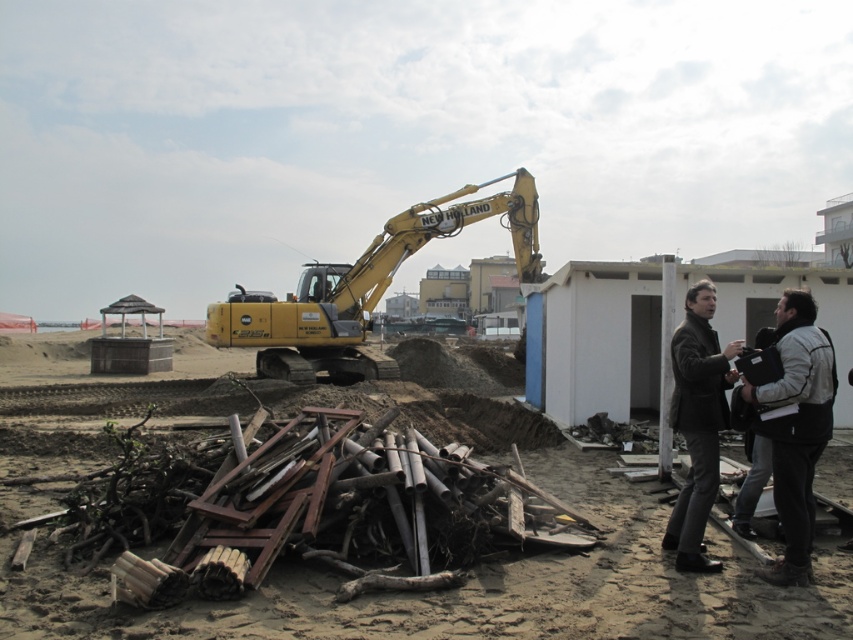
You are a construction worker who needs to move heavy equipment across the brown sandy dirt at center and the yellow metallic excavator at center. Which surface would provide a more stable base for the equipment?

The brown sandy dirt at center has a larger size compared to the yellow metallic excavator at center, so the brown sandy dirt at center would provide a more stable base for the equipment.

You are standing at the point with coordinates point (236, 333) and want to walk to the point with coordinates point (779, 392). Which direction should you move to get closer to your destination?

You should move forward because point (236, 333) is behind point (779, 392), so moving forward will bring you closer to the destination.